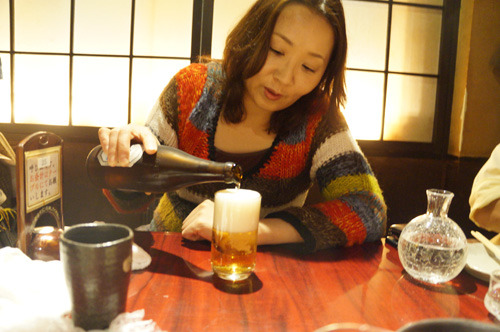
This screenshot has height=332, width=500. Find the location of `wall`. wall is located at coordinates (467, 116).